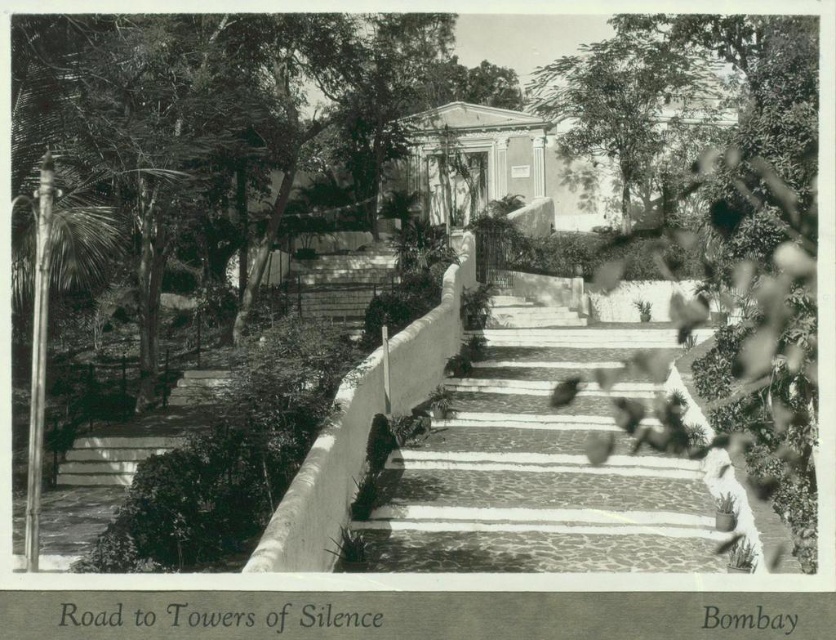
You are standing at the bottom of the pathway leading to the Towers of Silence in Mumbai. You notice a point marked at coordinates (222, 116). According to the image, what does this point indicate?

The point at (222, 116) marks a smooth green leafy tree at the center of the image.

You are standing on the marble stone steps at center and want to walk towards the Towers of Silence. Which direction should you move relative to the smooth green leafy tree at center?

You should move away from the smooth green leafy tree at center because it is in front of the marble stone steps at center, so moving away from it will lead you towards the path ahead towards the Towers of Silence.